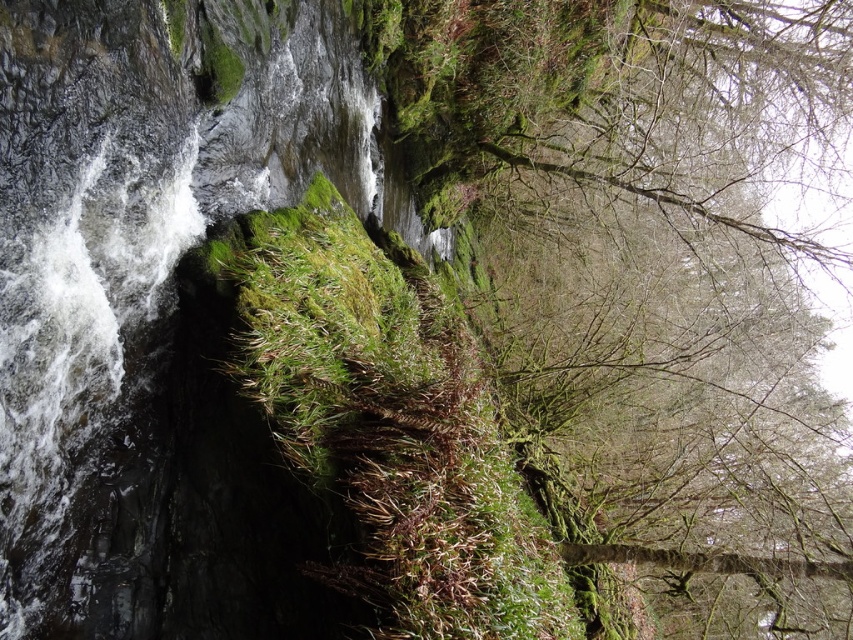
Question: Which object appears closest to the camera in this image?

Choices:
 (A) clear water at left
 (B) green mossy rock at center
 (C) green mossy tree at upper center

Answer: (A)

Question: Considering the relative positions of green mossy tree at upper center and green mossy rock at center in the image provided, where is green mossy tree at upper center located with respect to green mossy rock at center?

Choices:
 (A) above
 (B) below

Answer: (A)

Question: Which of the following is the farthest from the observer?

Choices:
 (A) (751, 484)
 (B) (392, 371)

Answer: (A)

Question: Can you confirm if clear water at left is positioned above green mossy rock at center?

Choices:
 (A) yes
 (B) no

Answer: (A)

Question: Estimate the real-world distances between objects in this image. Which object is farther from the clear water at left?

Choices:
 (A) green mossy tree at upper center
 (B) green mossy rock at center

Answer: (A)

Question: Does clear water at left appear under green mossy rock at center?

Choices:
 (A) yes
 (B) no

Answer: (B)